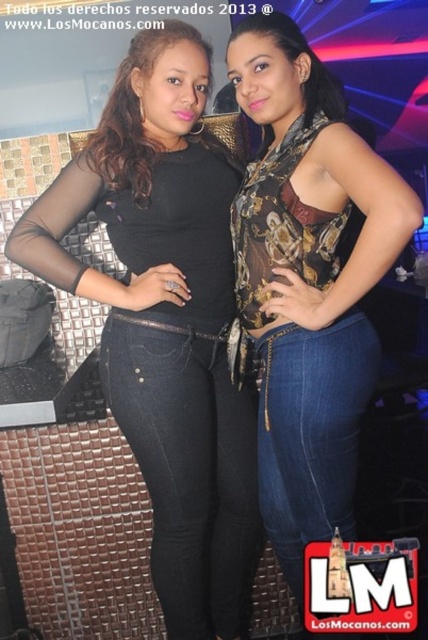
Question: Which point is closer to the camera?

Choices:
 (A) printed fabric top at center
 (B) matte black top at center

Answer: (A)

Question: Is matte black top at center above printed fabric top at center?

Choices:
 (A) no
 (B) yes

Answer: (A)

Question: Does matte black top at center appear on the left side of printed fabric top at center?

Choices:
 (A) no
 (B) yes

Answer: (B)

Question: Can you confirm if matte black top at center is smaller than printed fabric top at center?

Choices:
 (A) no
 (B) yes

Answer: (A)

Question: Among these points, which one is farthest from the camera?

Choices:
 (A) (285, 356)
 (B) (172, 211)

Answer: (B)